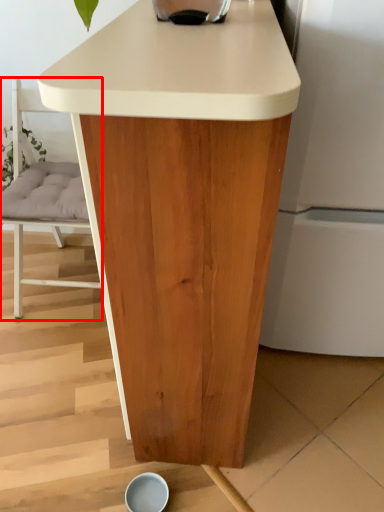
Question: From the image's perspective, where is chair (annotated by the red box) located relative to table?

Choices:
 (A) above
 (B) below

Answer: (A)